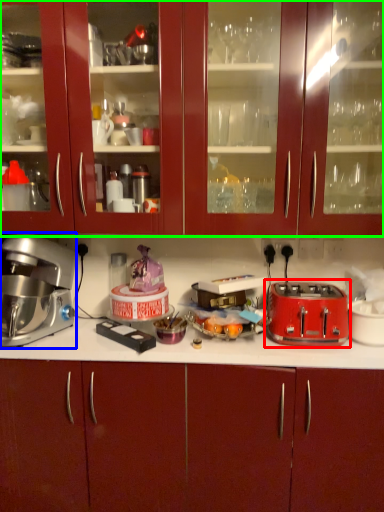
Question: Which is nearer to the toaster (highlighted by a red box)? home appliance (highlighted by a blue box) or cabinetry (highlighted by a green box).

Choices:
 (A) home appliance
 (B) cabinetry

Answer: (B)